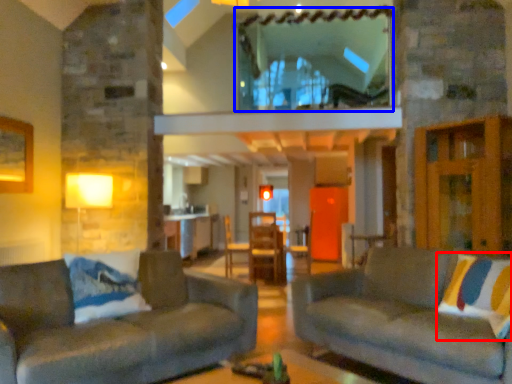
Question: Which point is further to the camera, pillow (highlighted by a red box) or window (highlighted by a blue box)?

Choices:
 (A) pillow
 (B) window

Answer: (B)